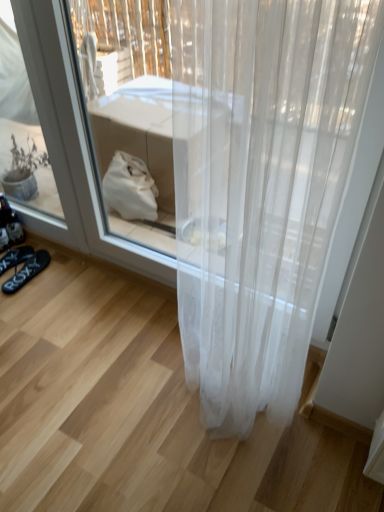
Question: Should I look upward or downward to see black rubber sandals at lower left, placed as the 1th footwear when sorted from left to right?

Choices:
 (A) up
 (B) down

Answer: (B)

Question: From a real-world perspective, is black rubber flip-flops at lower left, placed as the 1th footwear when sorted from right to left, over black rubber sandals at lower left, placed as the 1th footwear when sorted from left to right?

Choices:
 (A) yes
 (B) no

Answer: (B)

Question: From the image's perspective, does black rubber flip-flops at lower left, placed as the 1th footwear when sorted from right to left, appear lower than black rubber sandals at lower left, acting as the second footwear starting from the right?

Choices:
 (A) yes
 (B) no

Answer: (A)

Question: Is black rubber flip-flops at lower left, placed as the 1th footwear when sorted from right to left, positioned with its back to black rubber sandals at lower left, placed as the 1th footwear when sorted from left to right?

Choices:
 (A) yes
 (B) no

Answer: (B)

Question: Can you confirm if black rubber flip-flops at lower left, placed as the 1th footwear when sorted from right to left, is shorter than black rubber sandals at lower left, acting as the second footwear starting from the right?

Choices:
 (A) yes
 (B) no

Answer: (B)

Question: Is black rubber sandals at lower left, placed as the 1th footwear when sorted from left to right, surrounded by black rubber flip-flops at lower left, placed as the 1th footwear when sorted from right to left?

Choices:
 (A) no
 (B) yes

Answer: (A)

Question: Can you confirm if black rubber flip-flops at lower left, arranged as the 2th footwear when viewed from the left, is bigger than black rubber sandals at lower left, acting as the second footwear starting from the right?

Choices:
 (A) yes
 (B) no

Answer: (A)

Question: Considering the relative positions of black rubber sandals at lower left, placed as the 1th footwear when sorted from left to right, and black rubber flip-flops at lower left, arranged as the 2th footwear when viewed from the left, in the image provided, is black rubber sandals at lower left, placed as the 1th footwear when sorted from left to right, to the right of black rubber flip-flops at lower left, arranged as the 2th footwear when viewed from the left, from the viewer's perspective?

Choices:
 (A) yes
 (B) no

Answer: (B)

Question: Is black rubber flip-flops at lower left, placed as the 1th footwear when sorted from right to left, located within black rubber sandals at lower left, placed as the 1th footwear when sorted from left to right?

Choices:
 (A) no
 (B) yes

Answer: (A)

Question: Does black rubber sandals at lower left, acting as the second footwear starting from the right, turn towards black rubber flip-flops at lower left, arranged as the 2th footwear when viewed from the left?

Choices:
 (A) no
 (B) yes

Answer: (A)

Question: Is black rubber sandals at lower left, placed as the 1th footwear when sorted from left to right, facing away from black rubber flip-flops at lower left, arranged as the 2th footwear when viewed from the left?

Choices:
 (A) no
 (B) yes

Answer: (A)

Question: Does black rubber sandals at lower left, placed as the 1th footwear when sorted from left to right, come in front of black rubber flip-flops at lower left, arranged as the 2th footwear when viewed from the left?

Choices:
 (A) no
 (B) yes

Answer: (A)

Question: From the image's perspective, is black rubber sandals at lower left, placed as the 1th footwear when sorted from left to right, beneath black rubber flip-flops at lower left, placed as the 1th footwear when sorted from right to left?

Choices:
 (A) no
 (B) yes

Answer: (A)

Question: From a real-world perspective, is black rubber flip-flops at lower left, arranged as the 2th footwear when viewed from the left, physically located above or below black rubber sandals at lower left, acting as the second footwear starting from the right?

Choices:
 (A) below
 (B) above

Answer: (A)